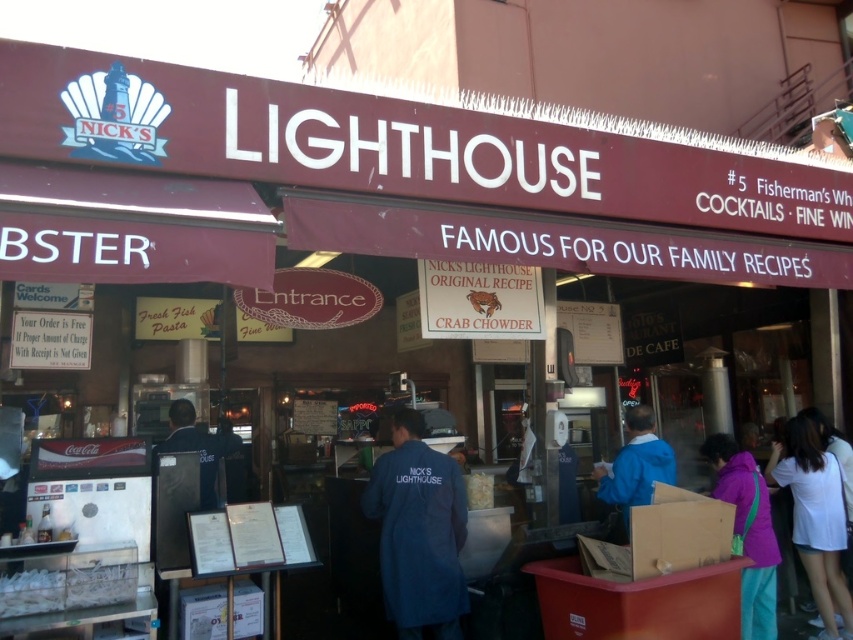
Is white cotton shirt at lower right above dark blue uniform at center?

Incorrect, white cotton shirt at lower right is not positioned above dark blue uniform at center.

Between white cotton shirt at lower right and dark blue uniform at center, which one is positioned lower?

white cotton shirt at lower right

Image resolution: width=853 pixels, height=640 pixels. In order to click on white cotton shirt at lower right in this screenshot , I will do `click(815, 518)`.

Describe the element at coordinates (418, 531) in the screenshot. I see `blue fabric coat at center` at that location.

Can you confirm if blue fabric coat at center is thinner than dark blue uniform at center?

Incorrect, blue fabric coat at center's width is not less than dark blue uniform at center's.

This screenshot has width=853, height=640. What do you see at coordinates (418, 531) in the screenshot?
I see `blue fabric coat at center` at bounding box center [418, 531].

The height and width of the screenshot is (640, 853). I want to click on blue fabric coat at center, so click(418, 531).

Who is higher up, blue fabric coat at center or white cotton shirt at lower right?

blue fabric coat at center

From the picture: Measure the distance between blue fabric coat at center and camera.

blue fabric coat at center and camera are 3.88 meters apart.

Which is behind, point (440, 628) or point (798, 548)?

The point (798, 548) is more distant.

The image size is (853, 640). Find the location of `blue fabric coat at center`. blue fabric coat at center is located at coordinates (418, 531).